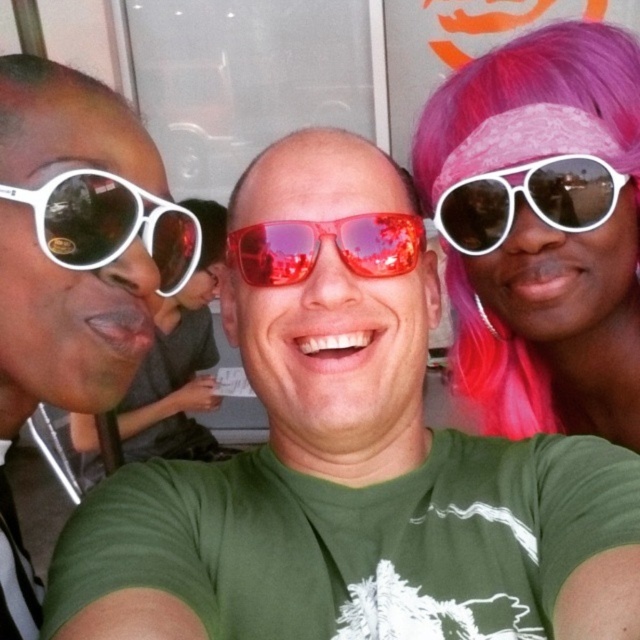
You are a photographer trying to capture a clear shot of both the matte white sunglasses at left and the white matte sunglasses at left. Since they are both on the left side of the frame, which pair of sunglasses should you focus on first to ensure the larger one is in sharp focus?

The matte white sunglasses at left has a larger size compared to the white matte sunglasses at left, so you should focus on the matte white sunglasses at left first to ensure it is in sharp focus.

You are taking a photo of the group and need to focus on the matte white sunglasses at left. Where exactly should you aim the camera to ensure the sunglasses are in the center of the photo?

The matte white sunglasses at left is located at point [74,268], so you should aim the camera at those coordinates to center them in the photo.